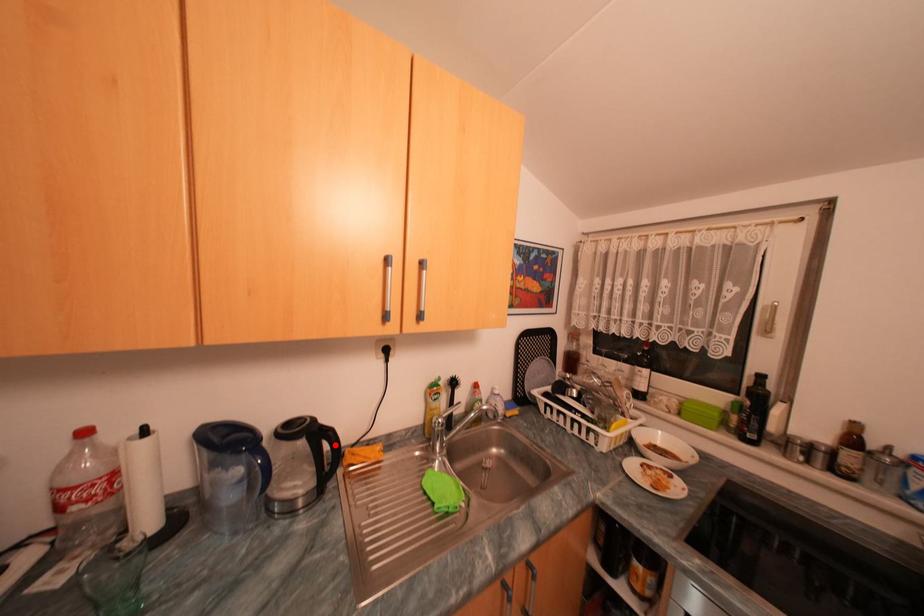
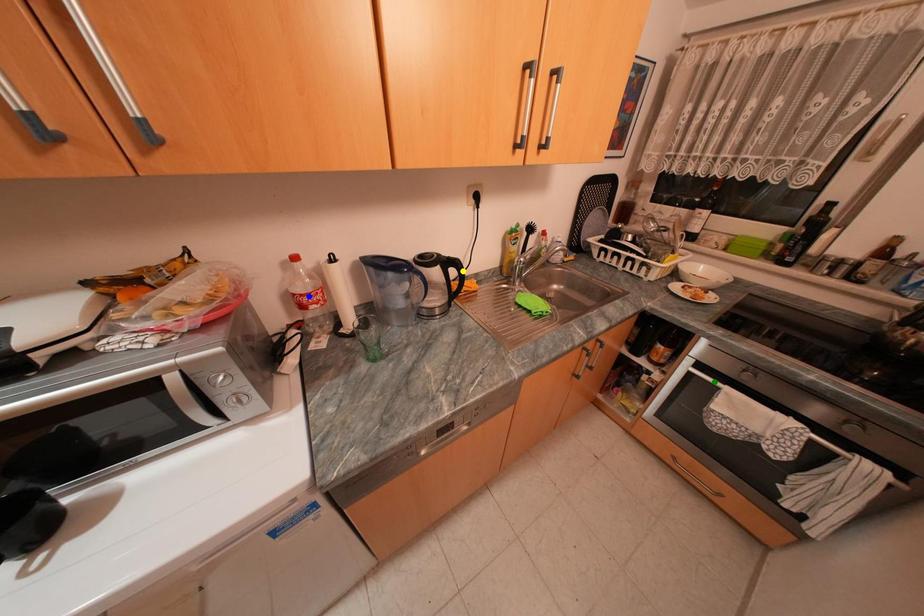
Question: I am providing you with two images of the same scene from different viewpoints. A red point is marked on the first image. You are given multiple points on the second image. Which spot in image 2 lines up with the point in image 1?

Choices:
 (A) yellow point
 (B) blue point
 (C) green point

Answer: (A)